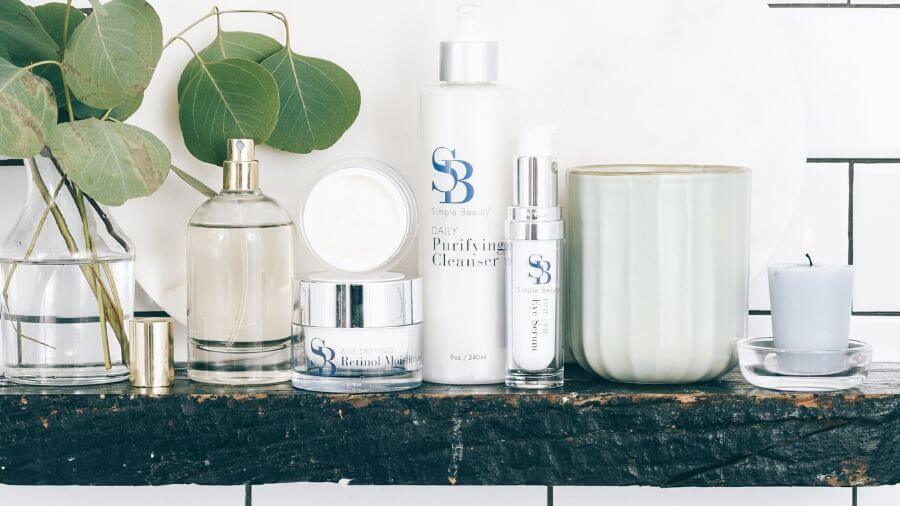
This screenshot has height=506, width=900. What are the coordinates of `dispenser` in the screenshot? It's located at [249, 151], [453, 30], [532, 180].